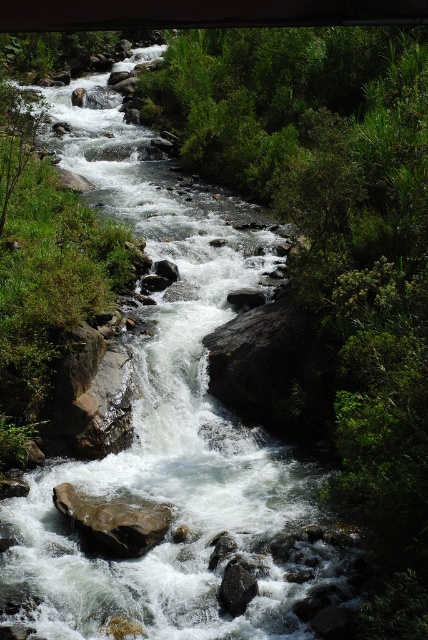
Question: Observing the image, what is the correct spatial positioning of brown rough rock at center in reference to black smooth rock at center?

Choices:
 (A) right
 (B) left

Answer: (B)

Question: Which object is closer to the camera taking this photo?

Choices:
 (A) black smooth rock at center
 (B) brown rough rock at center

Answer: (A)

Question: From the image, what is the correct spatial relationship of brown rough rock at center in relation to black smooth rock at center?

Choices:
 (A) left
 (B) right

Answer: (A)

Question: Can you confirm if brown rough rock at center is positioned to the right of black smooth rock at center?

Choices:
 (A) no
 (B) yes

Answer: (A)